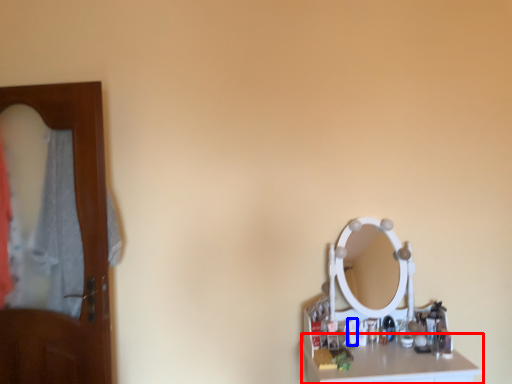
Question: Which point is closer to the camera, counter top (highlighted by a red box) or toiletry (highlighted by a blue box)?

Choices:
 (A) counter top
 (B) toiletry

Answer: (A)